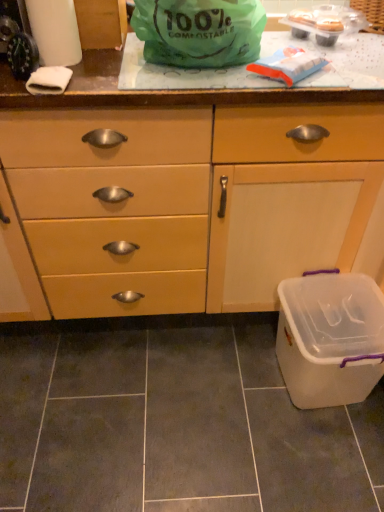
Question: Is green compostable bag at upper center inside the boundaries of matte wood cabinet at center, or outside?

Choices:
 (A) inside
 (B) outside

Answer: (B)

Question: In the image, is green compostable bag at upper center on the left side or the right side of matte wood cabinet at center?

Choices:
 (A) right
 (B) left

Answer: (B)

Question: Which is nearer to the white paper towel at upper left?

Choices:
 (A) white plastic container at lower right
 (B) green compostable bag at upper center
 (C) matte wood cabinet at center

Answer: (B)

Question: Which object is positioned closest to the white paper towel at upper left?

Choices:
 (A) matte wood cabinet at center
 (B) green compostable bag at upper center
 (C) white plastic container at lower right

Answer: (B)